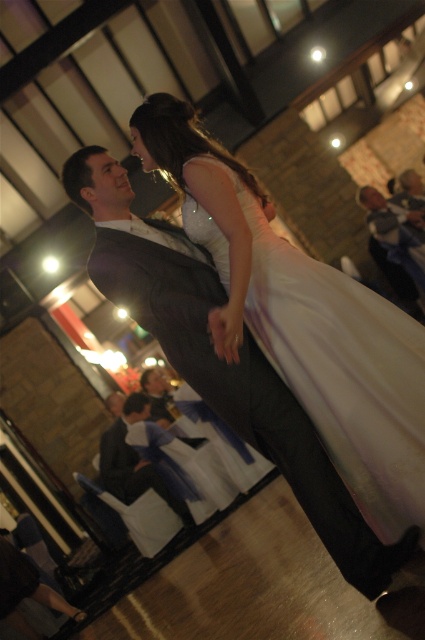
Based on the scene description, where is the white satin dress at center in relation to the dark gray suit at lower center?

The white satin dress at center is to the right of the dark gray suit at lower center.

You are a photographer at the wedding reception. You want to capture a photo of the white satin dress at center. Where should you aim your camera to ensure the dress is in the frame?

The white satin dress at center is located at point 0.577 on the x axis and 0.807 on the y axis, so aim your camera at those coordinates to capture the dress in the frame.